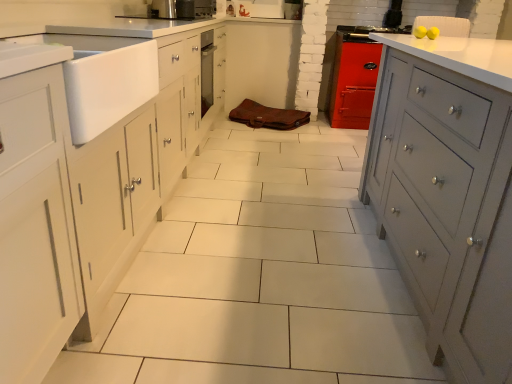
Question: Can you confirm if white matte sink at left is positioned to the left of matte gray cabinet at right?

Choices:
 (A) no
 (B) yes

Answer: (B)

Question: Considering the relative sizes of white matte sink at left and matte gray cabinet at right in the image provided, is white matte sink at left bigger than matte gray cabinet at right?

Choices:
 (A) no
 (B) yes

Answer: (A)

Question: Is white matte sink at left in contact with matte gray cabinet at right?

Choices:
 (A) yes
 (B) no

Answer: (B)

Question: Can you confirm if white matte sink at left is taller than matte gray cabinet at right?

Choices:
 (A) no
 (B) yes

Answer: (A)

Question: Does white matte sink at left turn towards matte gray cabinet at right?

Choices:
 (A) yes
 (B) no

Answer: (A)

Question: Does white matte sink at left have a lesser width compared to matte gray cabinet at right?

Choices:
 (A) yes
 (B) no

Answer: (A)

Question: Is metallic stainless steel oven at center at the right side of matte gray cabinet at right?

Choices:
 (A) yes
 (B) no

Answer: (B)

Question: Could you tell me if metallic stainless steel oven at center is facing matte gray cabinet at right?

Choices:
 (A) yes
 (B) no

Answer: (A)

Question: From the image's perspective, does metallic stainless steel oven at center appear lower than matte gray cabinet at right?

Choices:
 (A) no
 (B) yes

Answer: (A)

Question: Is metallic stainless steel oven at center thinner than matte gray cabinet at right?

Choices:
 (A) yes
 (B) no

Answer: (A)

Question: From the image's perspective, is metallic stainless steel oven at center on matte gray cabinet at right?

Choices:
 (A) yes
 (B) no

Answer: (A)

Question: Is metallic stainless steel oven at center looking in the opposite direction of matte gray cabinet at right?

Choices:
 (A) no
 (B) yes

Answer: (A)

Question: Is matte gray cabinet at right to the left of white matte sink at left from the viewer's perspective?

Choices:
 (A) no
 (B) yes

Answer: (A)